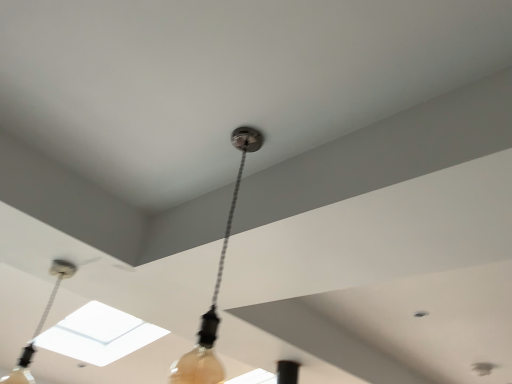
Question: Is matte black lamp at center, positioned as the 2th lamp in left-to-right order, in front of or behind matte black cord at upper center, the first lamp from the left, in the image?

Choices:
 (A) front
 (B) behind

Answer: (A)

Question: Is matte black lamp at center, acting as the second lamp starting from the back, wider or thinner than matte black cord at upper center, which is counted as the second lamp, starting from the front?

Choices:
 (A) thin
 (B) wide

Answer: (B)

Question: Is matte black lamp at center, which ranks as the first lamp in front-to-back order, to the left or to the right of matte black cord at upper center, which appears as the first lamp when viewed from the back, in the image?

Choices:
 (A) left
 (B) right

Answer: (B)

Question: In terms of width, does matte black cord at upper center, which appears as the first lamp when viewed from the back, look wider or thinner when compared to matte black lamp at center, positioned as the 2th lamp in left-to-right order?

Choices:
 (A) wide
 (B) thin

Answer: (B)

Question: In terms of height, does matte black cord at upper center, which is counted as the second lamp, starting from the front, look taller or shorter compared to matte black lamp at center, which ranks as the first lamp in front-to-back order?

Choices:
 (A) tall
 (B) short

Answer: (B)

Question: Considering their positions, is matte black cord at upper center, which appears as the first lamp when viewed from the back, located in front of or behind matte black lamp at center, acting as the second lamp starting from the back?

Choices:
 (A) behind
 (B) front

Answer: (A)

Question: From the image's perspective, is matte black cord at upper center, which appears as the first lamp when viewed from the back, positioned above or below matte black lamp at center, acting as the second lamp starting from the back?

Choices:
 (A) below
 (B) above

Answer: (A)